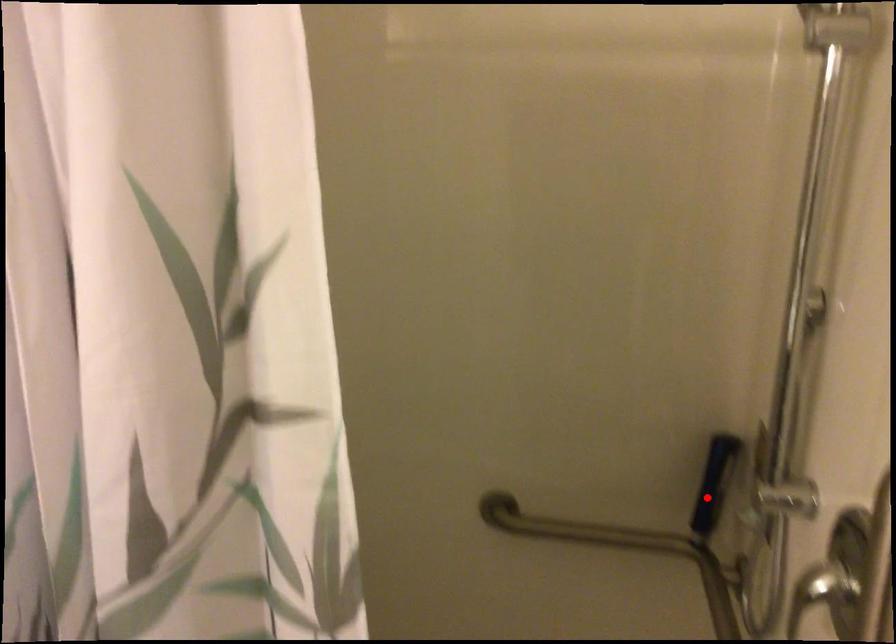
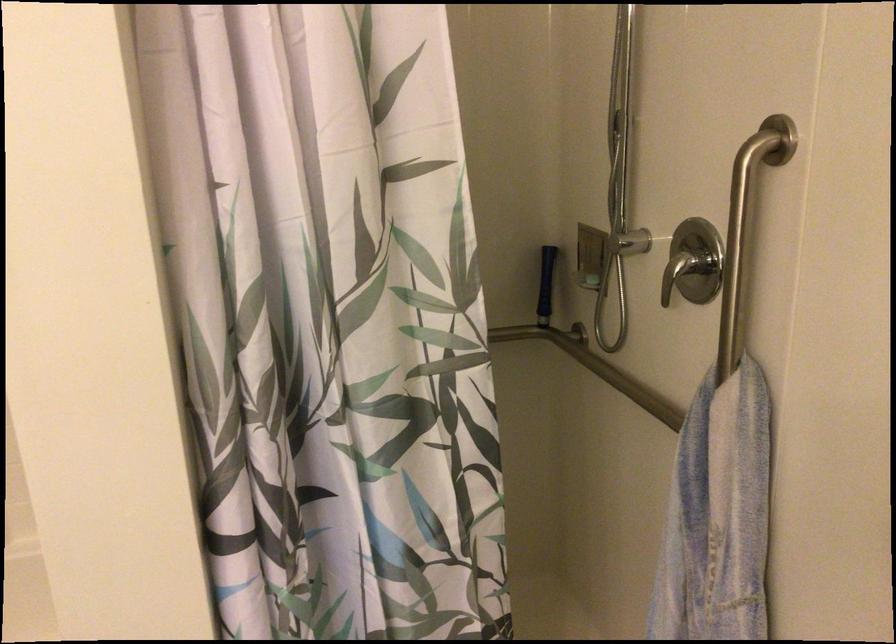
In the second image, find the point that corresponds to the highlighted location in the first image.

(546, 285)